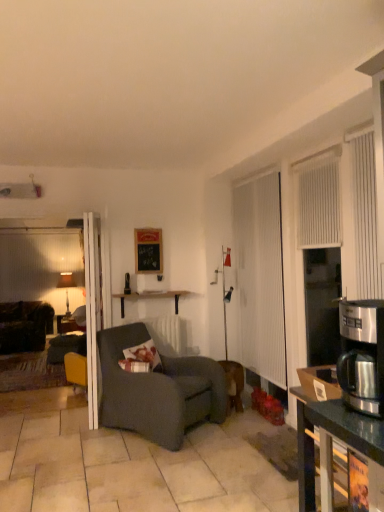
Image resolution: width=384 pixels, height=512 pixels. In order to click on vacant space in front of dark gray fabric chair at center in this screenshot , I will do `click(171, 474)`.